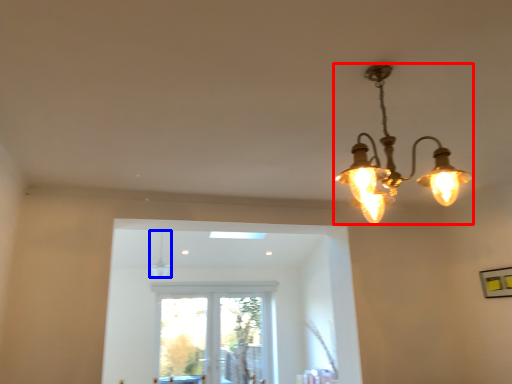
Question: Which object is further to the camera taking this photo, lamp (highlighted by a red box) or lamp (highlighted by a blue box)?

Choices:
 (A) lamp
 (B) lamp

Answer: (B)